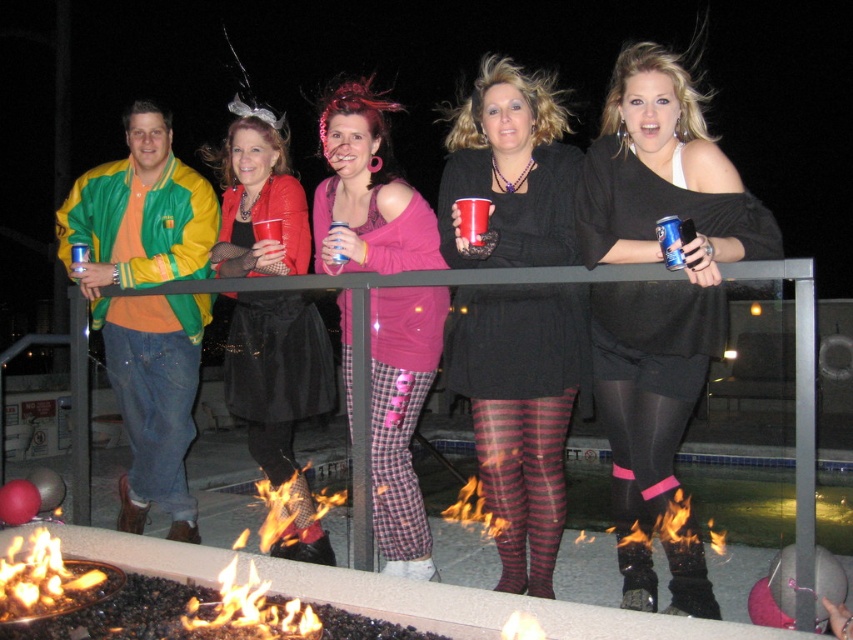
Question: Does black knit dress at center have a larger size compared to black satin skirt at center?

Choices:
 (A) no
 (B) yes

Answer: (A)

Question: Which object is the closest to the green/yellow nylon jacket at left?

Choices:
 (A) black knit dress at center
 (B) black satin skirt at center
 (C) matte black dress at center

Answer: (C)

Question: Which object is closer to the camera taking this photo?

Choices:
 (A) green/yellow nylon jacket at left
 (B) black satin skirt at center

Answer: (B)

Question: Estimate the real-world distances between objects in this image. Which object is closer to the pink plaid pants at center?

Choices:
 (A) black sheer tights at center
 (B) matte plastic cup at center
 (C) black knit dress at center
 (D) black satin skirt at center

Answer: (D)

Question: Is black sheer tights at center closer to camera compared to black knit dress at center?

Choices:
 (A) yes
 (B) no

Answer: (A)

Question: Does pink fabric pants at center have a larger size compared to black satin skirt at center?

Choices:
 (A) no
 (B) yes

Answer: (B)